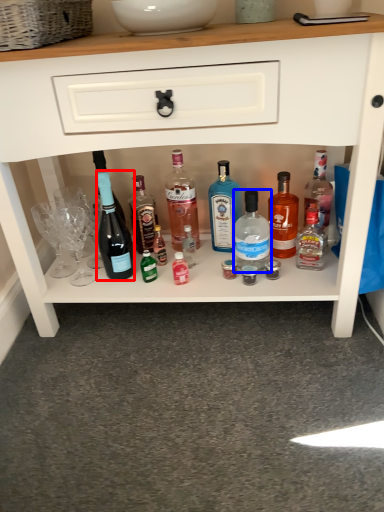
Question: Among these objects, which one is nearest to the camera, bottle (highlighted by a red box) or bottle (highlighted by a blue box)?

Choices:
 (A) bottle
 (B) bottle

Answer: (A)